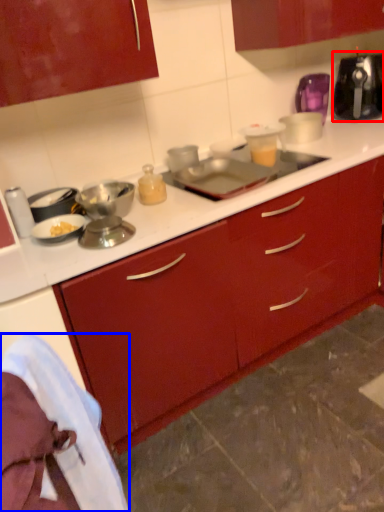
Question: Which point is closer to the camera, kitchen appliance (highlighted by a red box) or material (highlighted by a blue box)?

Choices:
 (A) kitchen appliance
 (B) material

Answer: (B)